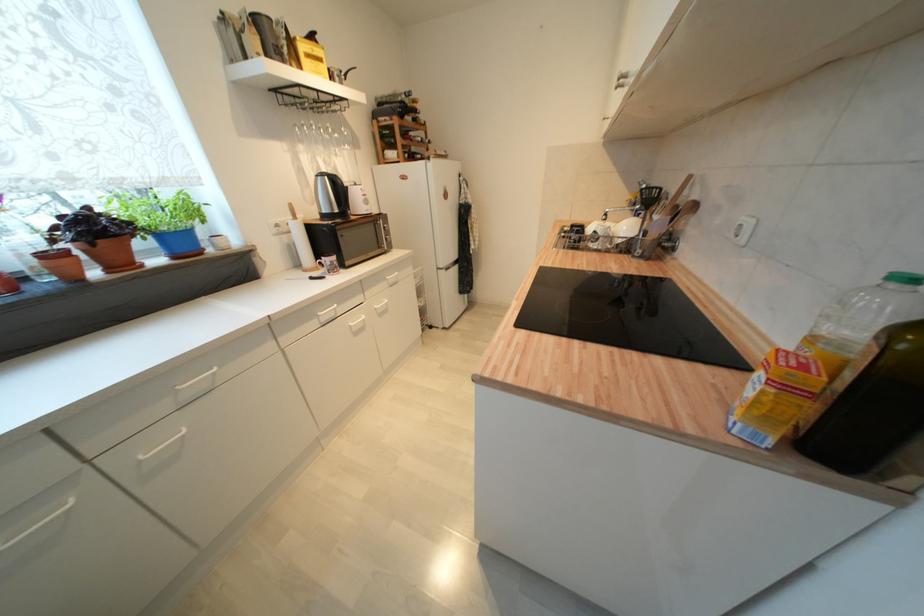
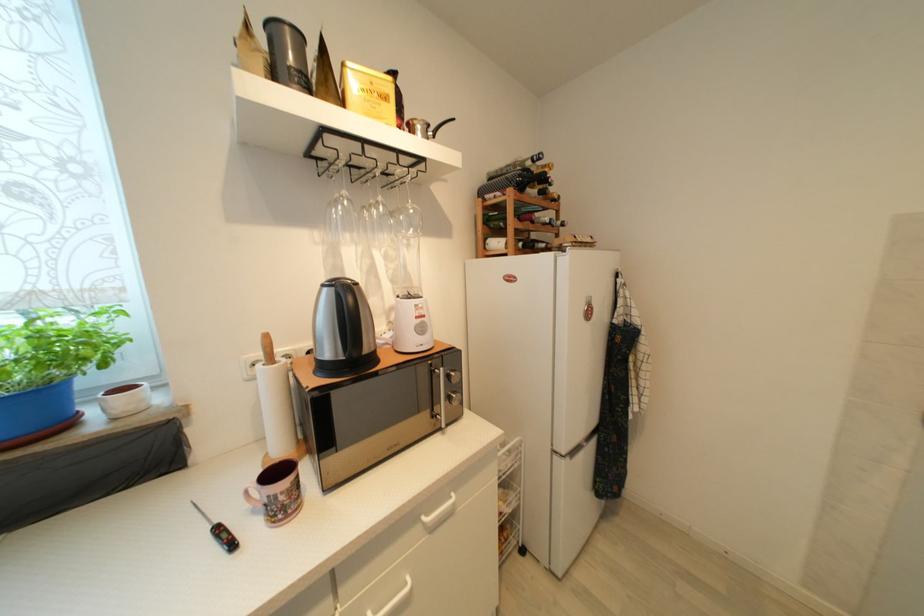
Where in the second image is the point corresponding to point (325, 62) from the first image?

(391, 100)